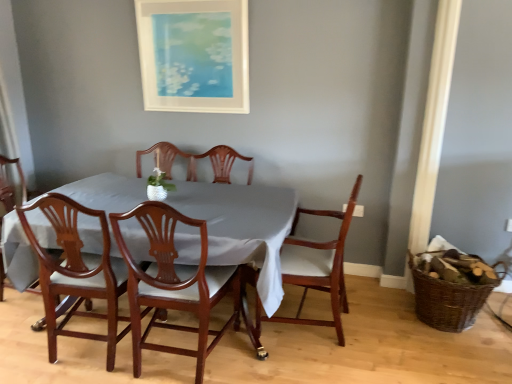
Question: Is mahogany table at center far away from mahogany wood chair at lower left, positioned as the 3th chair in right-to-left order?

Choices:
 (A) yes
 (B) no

Answer: (B)

Question: Can you confirm if mahogany table at center is positioned to the left of mahogany wood chair at lower left, positioned as the 3th chair in right-to-left order?

Choices:
 (A) yes
 (B) no

Answer: (B)

Question: Can you confirm if mahogany table at center is wider than mahogany wood chair at lower left, positioned as the 3th chair in right-to-left order?

Choices:
 (A) yes
 (B) no

Answer: (A)

Question: Is the position of mahogany table at center less distant than that of mahogany wood chair at lower left, positioned as the 3th chair in right-to-left order?

Choices:
 (A) yes
 (B) no

Answer: (B)

Question: Is mahogany wood chair at lower left, positioned as the 3th chair in right-to-left order, located within mahogany table at center?

Choices:
 (A) yes
 (B) no

Answer: (A)

Question: Considering their positions, is mahogany wood chair at center, which ranks as the 3th chair in left-to-right order, located in front of or behind matte white picture frame at upper center?

Choices:
 (A) front
 (B) behind

Answer: (A)

Question: Is mahogany wood chair at center, which ranks as the 3th chair in left-to-right order, to the left or to the right of matte white picture frame at upper center in the image?

Choices:
 (A) right
 (B) left

Answer: (A)

Question: From the image's perspective, is mahogany wood chair at center, which ranks as the 3th chair in left-to-right order, positioned above or below matte white picture frame at upper center?

Choices:
 (A) below
 (B) above

Answer: (A)

Question: Would you say mahogany wood chair at center, the 2th chair positioned from the right, is inside or outside matte white picture frame at upper center?

Choices:
 (A) inside
 (B) outside

Answer: (B)

Question: Is point (114, 336) closer or farther from the camera than point (468, 324)?

Choices:
 (A) farther
 (B) closer

Answer: (B)

Question: From their relative heights in the image, would you say mahogany wood chair at lower left, the 2th chair viewed from the left, is taller or shorter than brown woven basket at right?

Choices:
 (A) tall
 (B) short

Answer: (A)

Question: From a real-world perspective, is mahogany wood chair at lower left, the 2th chair viewed from the left, above or below brown woven basket at right?

Choices:
 (A) below
 (B) above

Answer: (B)

Question: Looking at their shapes, would you say mahogany wood chair at lower left, positioned as the 3th chair in right-to-left order, is wider or thinner than brown woven basket at right?

Choices:
 (A) wide
 (B) thin

Answer: (A)

Question: From the image's perspective, is mahogany table at center located above or below brown woven basket at right?

Choices:
 (A) above
 (B) below

Answer: (A)

Question: Considering the positions of point (268, 279) and point (413, 273), is point (268, 279) closer or farther from the camera than point (413, 273)?

Choices:
 (A) closer
 (B) farther

Answer: (A)